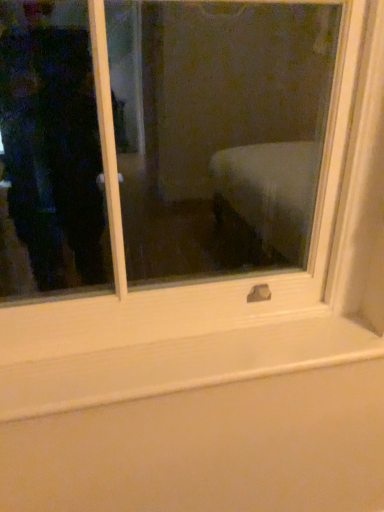
Image resolution: width=384 pixels, height=512 pixels. I want to click on free point above white matte bathtub at lower center (from a real-world perspective), so click(x=204, y=342).